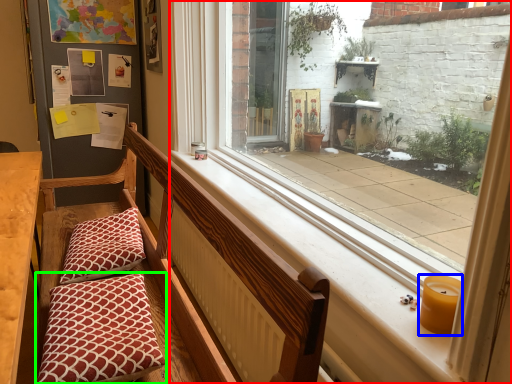
Question: Which object is the closest to the window (highlighted by a red box)? Choose among these: candle holder (highlighted by a blue box) or pillow (highlighted by a green box).

Choices:
 (A) candle holder
 (B) pillow

Answer: (A)